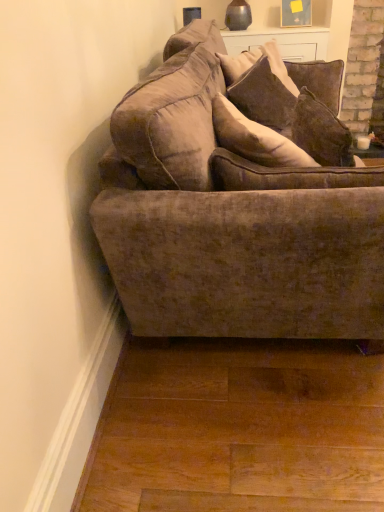
Question: Is velvet brown couch at center outside of velvet brown pillow at upper center, the second pillow when ordered from back to front?

Choices:
 (A) no
 (B) yes

Answer: (B)

Question: Is velvet brown couch at center turned away from velvet brown pillow at upper center, the second pillow when ordered from back to front?

Choices:
 (A) yes
 (B) no

Answer: (A)

Question: Does velvet brown couch at center come in front of velvet brown pillow at upper center, the second pillow when ordered from back to front?

Choices:
 (A) yes
 (B) no

Answer: (A)

Question: Is velvet brown couch at center bigger than velvet brown pillow at upper center, which is the first pillow in front-to-back order?

Choices:
 (A) no
 (B) yes

Answer: (B)

Question: Is velvet brown couch at center smaller than velvet brown pillow at upper center, which is the first pillow in front-to-back order?

Choices:
 (A) yes
 (B) no

Answer: (B)

Question: From a real-world perspective, is velvet brown pillow at upper center, the second pillow when ordered from back to front, physically located above or below velvet brown couch at center?

Choices:
 (A) below
 (B) above

Answer: (B)

Question: Based on their sizes in the image, would you say velvet brown pillow at upper center, which is the first pillow in front-to-back order, is bigger or smaller than velvet brown couch at center?

Choices:
 (A) small
 (B) big

Answer: (A)

Question: Is velvet brown pillow at upper center, the second pillow when ordered from back to front, situated inside velvet brown couch at center or outside?

Choices:
 (A) outside
 (B) inside

Answer: (B)

Question: Is point (244, 83) positioned closer to the camera than point (183, 96)?

Choices:
 (A) farther
 (B) closer

Answer: (A)

Question: From a real-world perspective, relative to velvet brown pillow at upper center, which is the first pillow in front-to-back order, is velvet brown pillow at upper center, placed as the 1th pillow when sorted from back to front, vertically above or below?

Choices:
 (A) above
 (B) below

Answer: (B)

Question: Is velvet brown pillow at upper center, the second pillow when ordered from front to back, bigger or smaller than velvet brown pillow at upper center, the second pillow when ordered from back to front?

Choices:
 (A) small
 (B) big

Answer: (B)

Question: Do you think velvet brown pillow at upper center, the second pillow when ordered from front to back, is within velvet brown pillow at upper center, which is the first pillow in front-to-back order, or outside of it?

Choices:
 (A) outside
 (B) inside

Answer: (A)

Question: Considering the positions of point (251, 53) and point (236, 95), is point (251, 53) closer or farther from the camera than point (236, 95)?

Choices:
 (A) farther
 (B) closer

Answer: (A)

Question: Does point 283,70 appear closer or farther from the camera than point 198,304?

Choices:
 (A) farther
 (B) closer

Answer: (A)

Question: From the image's perspective, is velvet brown pillow at upper center, placed as the 1th pillow when sorted from back to front, located above or below velvet brown couch at center?

Choices:
 (A) above
 (B) below

Answer: (A)